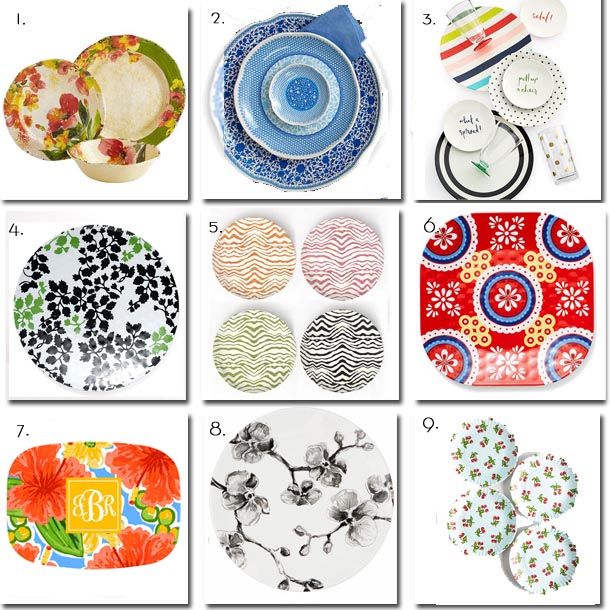
At what (x,y) coordinates should I click in order to perform the action: click on size of tile corner to corner. Please return your answer as a coordinate pair (x, y). This screenshot has width=610, height=610. Looking at the image, I should click on (5, 213), (184, 212), (184, 396), (7, 398).